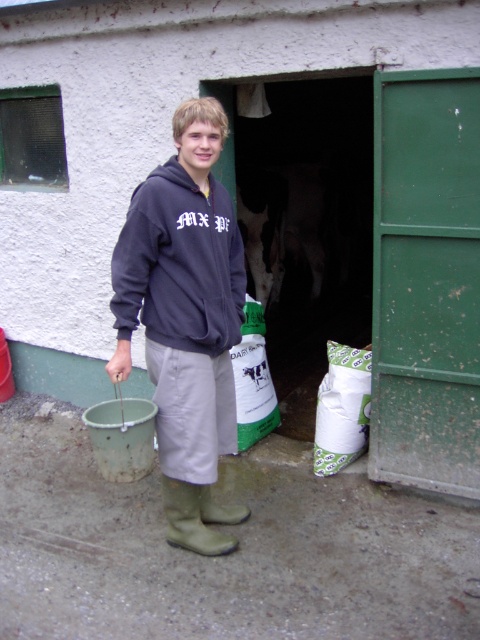
Which of these two, matte gray hoodie at center or dark gray fleece sweatshirt at center, stands taller?

matte gray hoodie at center is taller.

Based on the photo, is matte gray hoodie at center to the left of dark gray fleece sweatshirt at center from the viewer's perspective?

Indeed, matte gray hoodie at center is positioned on the left side of dark gray fleece sweatshirt at center.

Locate an element on the screen. matte gray hoodie at center is located at coordinates (186, 320).

Is dark gray fleece sweatshirt at center above green rubber boot at lower center?

Yes, dark gray fleece sweatshirt at center is above green rubber boot at lower center.

Does dark gray fleece sweatshirt at center have a greater width compared to green rubber boot at lower center?

Yes.

Find the location of a particular element. The height and width of the screenshot is (640, 480). dark gray fleece sweatshirt at center is located at coordinates (180, 264).

Is the position of matte gray hoodie at center more distant than that of green rubber boot at lower center?

No, matte gray hoodie at center is in front of green rubber boot at lower center.

Is matte gray hoodie at center in front of green rubber boot at lower center?

That is True.

What do you see at coordinates (186, 320) in the screenshot?
I see `matte gray hoodie at center` at bounding box center [186, 320].

Identify the location of matte gray hoodie at center. (186, 320).